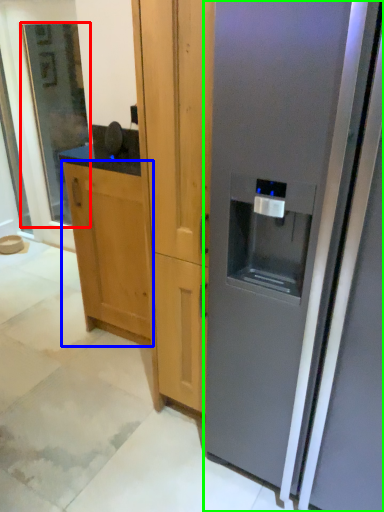
Question: Estimate the real-world distances between objects in this image. Which object is closer to glass door (highlighted by a red box), cabinetry (highlighted by a blue box) or refrigerator (highlighted by a green box)?

Choices:
 (A) cabinetry
 (B) refrigerator

Answer: (A)